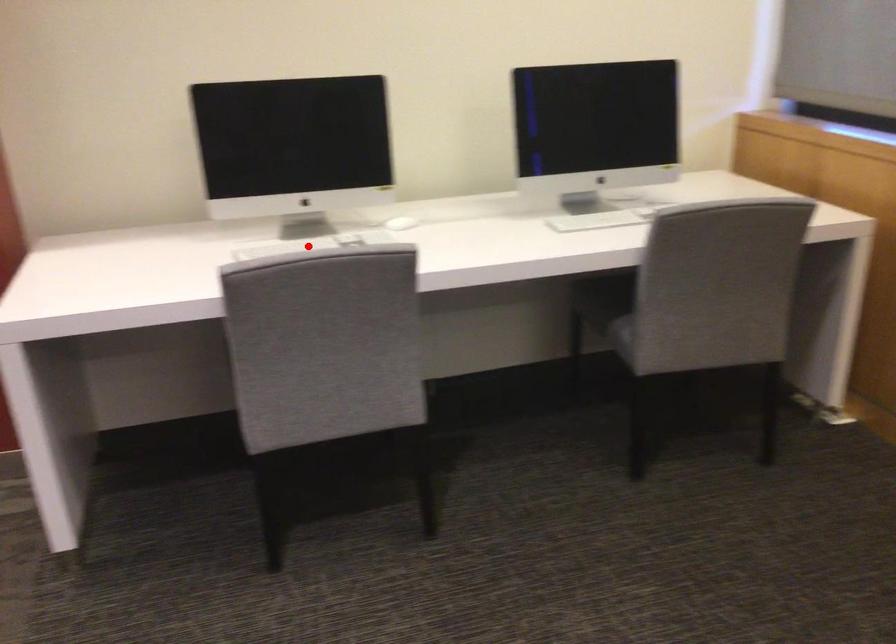
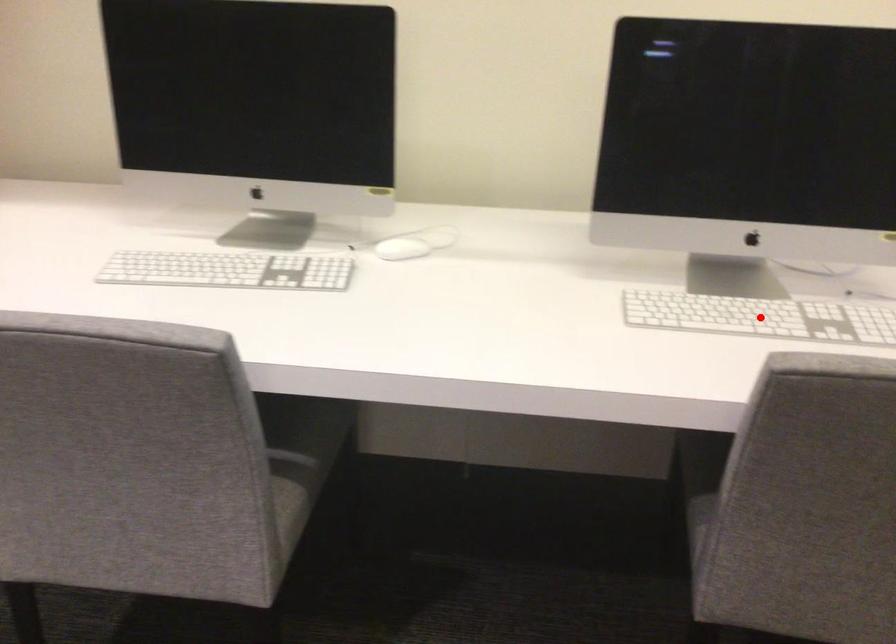
I am providing you with two images of the same scene from different viewpoints. A red point is marked on the first image and another point is marked on the second image. Is the marked point in image1 the same physical position as the marked point in image2?

No